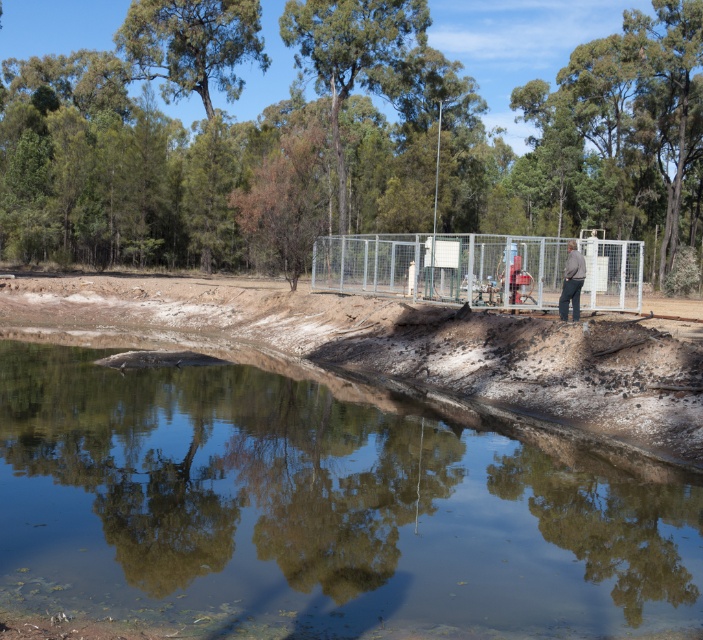
Measure the distance between clear water at center and gray fabric jacket at center.

32.60 feet

Who is positioned more to the right, clear water at center or gray fabric jacket at center?

From the viewer's perspective, gray fabric jacket at center appears more on the right side.

Does point (143, 380) come farther from viewer compared to point (574, 308)?

That is False.

Find the location of a particular element. This screenshot has width=703, height=640. clear water at center is located at coordinates (322, 509).

Between metallic fence at center and gray fabric jacket at center, which one appears on the right side from the viewer's perspective?

Positioned to the right is gray fabric jacket at center.

Is metallic fence at center closer to camera compared to gray fabric jacket at center?

No, it is behind gray fabric jacket at center.

The height and width of the screenshot is (640, 703). I want to click on metallic fence at center, so click(x=444, y=268).

Between clear water at center and metallic fence at center, which one has less height?

With less height is clear water at center.

Does clear water at center come behind metallic fence at center?

No.

Between point (141, 611) and point (528, 273), which one is positioned in front?

Point (141, 611)

Where is `clear water at center`? clear water at center is located at coordinates (322, 509).